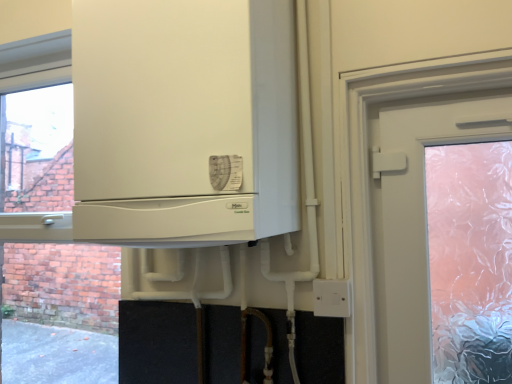
Identify the location of white plastic electric outlet at lower right. This screenshot has height=384, width=512. (331, 298).

The width and height of the screenshot is (512, 384). Describe the element at coordinates (331, 298) in the screenshot. I see `white plastic electric outlet at lower right` at that location.

What do you see at coordinates (185, 122) in the screenshot? The height and width of the screenshot is (384, 512). I see `white matte cabinet at center` at bounding box center [185, 122].

In order to face white matte cabinet at center, should I rotate leftwards or rightwards?

A 8.789 degree turn to the left will do.

In order to click on white matte cabinet at center in this screenshot , I will do `click(185, 122)`.

Find the location of a particular element. white plastic electric outlet at lower right is located at coordinates coord(331,298).

Which object is positioned more to the right, white plastic electric outlet at lower right or white matte cabinet at center?

From the viewer's perspective, white plastic electric outlet at lower right appears more on the right side.

Is white plastic electric outlet at lower right positioned in front of white matte cabinet at center?

No, it is not.

Between point (328, 307) and point (229, 140), which one is positioned in front?

Point (229, 140)

Consider the image. From the image's perspective, between white plastic electric outlet at lower right and white matte cabinet at center, which one is located above?

white matte cabinet at center appears higher in the image.

From a real-world perspective, which is physically above, white plastic electric outlet at lower right or white matte cabinet at center?

In real-world perspective, white matte cabinet at center is above.

Which object is wider, white plastic electric outlet at lower right or white matte cabinet at center?

white matte cabinet at center.

Which of these two, white plastic electric outlet at lower right or white matte cabinet at center, stands shorter?

white plastic electric outlet at lower right.

Does white plastic electric outlet at lower right have a larger size compared to white matte cabinet at center?

Actually, white plastic electric outlet at lower right might be smaller than white matte cabinet at center.

Is white plastic electric outlet at lower right located outside white matte cabinet at center?

Yes, white plastic electric outlet at lower right is not within white matte cabinet at center.

Is white plastic electric outlet at lower right far from white matte cabinet at center?

That's not correct — white plastic electric outlet at lower right is a little close to white matte cabinet at center.

Is white plastic electric outlet at lower right looking in the opposite direction of white matte cabinet at center?

A: No, white plastic electric outlet at lower right is not facing away from white matte cabinet at center.

How many degrees apart are the facing directions of white plastic electric outlet at lower right and white matte cabinet at center?

0.364 degrees separate the facing orientations of white plastic electric outlet at lower right and white matte cabinet at center.

The height and width of the screenshot is (384, 512). In order to click on cabinetry above the white plastic electric outlet at lower right (from the image's perspective) in this screenshot , I will do `click(185, 122)`.

Does white matte cabinet at center appear on the right side of white plastic electric outlet at lower right?

In fact, white matte cabinet at center is to the left of white plastic electric outlet at lower right.

Consider the image. Who is more distant, white matte cabinet at center or white plastic electric outlet at lower right?

white plastic electric outlet at lower right is behind.

Which is nearer, (215, 13) or (344, 313)?

Clearly, point (215, 13) is closer to the camera than point (344, 313).

From the image's perspective, between white matte cabinet at center and white plastic electric outlet at lower right, which one is located above?

white matte cabinet at center.

From a real-world perspective, relative to white plastic electric outlet at lower right, is white matte cabinet at center vertically above or below?

From a real-world perspective, white matte cabinet at center is physically above white plastic electric outlet at lower right.

Which object is wider, white matte cabinet at center or white plastic electric outlet at lower right?

white matte cabinet at center.

Between white matte cabinet at center and white plastic electric outlet at lower right, which one has more height?

white matte cabinet at center.

Who is bigger, white matte cabinet at center or white plastic electric outlet at lower right?

Bigger between the two is white matte cabinet at center.

Is white matte cabinet at center inside the boundaries of white plastic electric outlet at lower right, or outside?

The correct answer is: outside.

Is white matte cabinet at center touching white plastic electric outlet at lower right?

No.

Is white matte cabinet at center turned away from white plastic electric outlet at lower right?

No, white matte cabinet at center is not facing away from white plastic electric outlet at lower right.

What's the angular difference between white matte cabinet at center and white plastic electric outlet at lower right's facing directions?

0.364 degrees separate the facing orientations of white matte cabinet at center and white plastic electric outlet at lower right.

How far apart are white matte cabinet at center and white plastic electric outlet at lower right?

white matte cabinet at center is 19.85 inches away from white plastic electric outlet at lower right.

Where is `cabinetry that appears in front of the white plastic electric outlet at lower right`? cabinetry that appears in front of the white plastic electric outlet at lower right is located at coordinates (185, 122).

Where is `cabinetry lying above the white plastic electric outlet at lower right (from the image's perspective)`? This screenshot has width=512, height=384. cabinetry lying above the white plastic electric outlet at lower right (from the image's perspective) is located at coordinates (185, 122).

Where is `electric outlet lying behind the white matte cabinet at center`? The height and width of the screenshot is (384, 512). electric outlet lying behind the white matte cabinet at center is located at coordinates (331, 298).